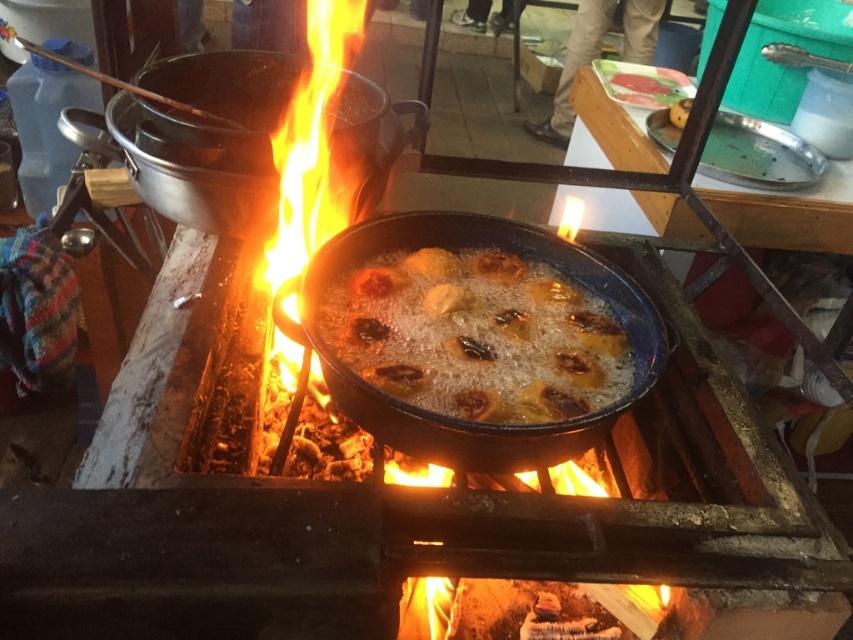
Is khaki fabric pants at upper center bigger than smooth yellowish-brown pastry at center?

Indeed, khaki fabric pants at upper center has a larger size compared to smooth yellowish-brown pastry at center.

What do you see at coordinates (573, 68) in the screenshot? The image size is (853, 640). I see `khaki fabric pants at upper center` at bounding box center [573, 68].

Identify the location of khaki fabric pants at upper center. This screenshot has width=853, height=640. (573, 68).

Is black cast iron frying pan at center thinner than smooth yellowish-brown pastry at center?

No, black cast iron frying pan at center is not thinner than smooth yellowish-brown pastry at center.

Is black cast iron frying pan at center taller than smooth yellowish-brown pastry at center?

Indeed, black cast iron frying pan at center has a greater height compared to smooth yellowish-brown pastry at center.

Where is `black cast iron frying pan at center`? Image resolution: width=853 pixels, height=640 pixels. black cast iron frying pan at center is located at coordinates (199, 138).

This screenshot has height=640, width=853. Identify the location of black cast iron frying pan at center. (199, 138).

Find the location of a particular element. The width and height of the screenshot is (853, 640). bright orange flame at center is located at coordinates [x=309, y=172].

The height and width of the screenshot is (640, 853). Describe the element at coordinates (309, 172) in the screenshot. I see `bright orange flame at center` at that location.

Where is `bright orange flame at center`? bright orange flame at center is located at coordinates (309, 172).